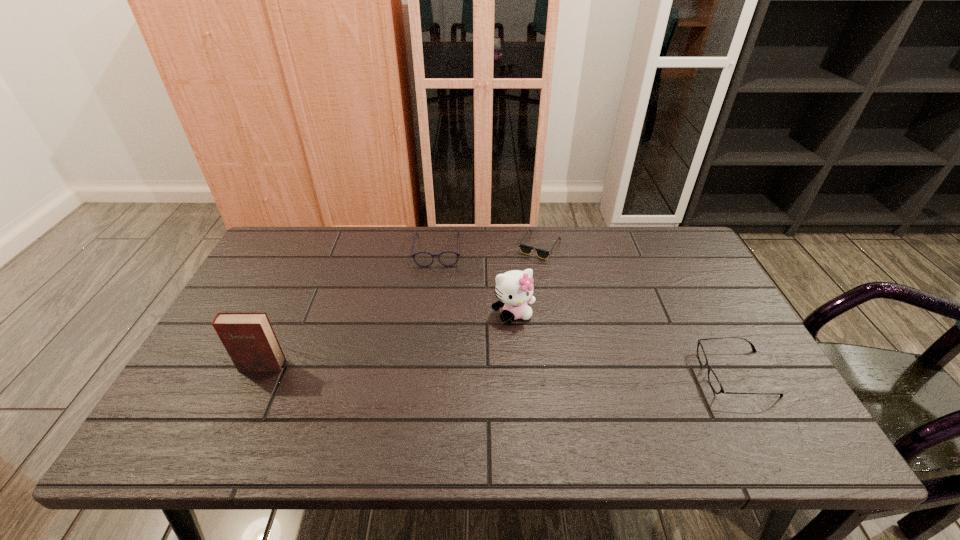
You are a GUI agent. You are given a task and a screenshot of the screen. Output one action in this format:
    pyautogui.click(x=<x>, y=<y>)
    Task: Click on the diary
    
    Given the screenshot: What is the action you would take?
    pyautogui.click(x=248, y=337)

At what (x,y) coordinates should I click in order to perform the action: click on the nearer spectacles. Please return your answer as a coordinate pair (x, y). This screenshot has height=540, width=960. Looking at the image, I should click on (713, 379).

Where is `the right spectacles`? The width and height of the screenshot is (960, 540). the right spectacles is located at coordinates (713, 379).

Locate an element on the screen. the farther spectacles is located at coordinates (447, 258).

What are the coordinates of `the third tallest object` in the screenshot? It's located at (447, 258).

I want to click on the third nearest object, so click(x=515, y=288).

Find the location of a particular element. kitten is located at coordinates (515, 288).

Identify the location of the shortest object. This screenshot has width=960, height=540. [x=525, y=249].

At what (x,y) coordinates should I click in order to perform the action: click on vacant space situated on the front cover of the diary. Please return your answer as a coordinate pair (x, y). Looking at the image, I should click on (245, 404).

Identify the location of free region located 0.240m on the front-facing side of the rightmost object. The image size is (960, 540). (604, 374).